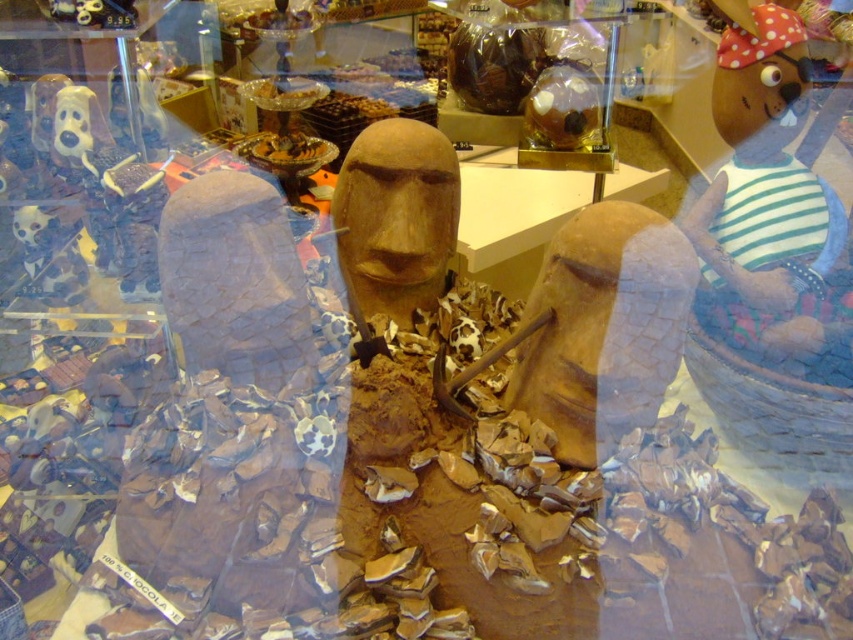
Question: Is striped fabric bear at upper right further to the viewer compared to matte brown statue at center?

Choices:
 (A) no
 (B) yes

Answer: (B)

Question: Is striped fabric bear at upper right above matte brown statue at center?

Choices:
 (A) yes
 (B) no

Answer: (A)

Question: Which point is farther to the camera?

Choices:
 (A) matte brown statue at center
 (B) striped fabric bear at upper right

Answer: (B)

Question: Observing the image, what is the correct spatial positioning of striped fabric bear at upper right in reference to matte brown statue at center?

Choices:
 (A) right
 (B) left

Answer: (A)

Question: Among these points, which one is farthest from the camera?

Choices:
 (A) (749, 292)
 (B) (422, 284)

Answer: (B)

Question: Which object appears farthest from the camera in this image?

Choices:
 (A) matte brown statue at center
 (B) striped fabric bear at upper right

Answer: (B)